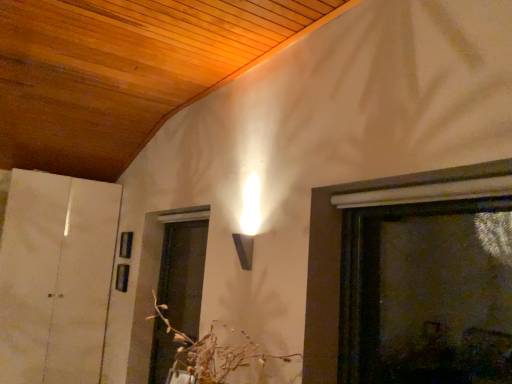
Question: Is white paper at left not inside brown textured floral arrangement at center?

Choices:
 (A) no
 (B) yes

Answer: (B)

Question: From the image's perspective, is white paper at left above brown textured floral arrangement at center?

Choices:
 (A) yes
 (B) no

Answer: (B)

Question: From the image's perspective, is white paper at left located beneath brown textured floral arrangement at center?

Choices:
 (A) no
 (B) yes

Answer: (B)

Question: Is the position of white paper at left less distant than that of brown textured floral arrangement at center?

Choices:
 (A) no
 (B) yes

Answer: (A)

Question: Is white paper at left to the right of brown textured floral arrangement at center from the viewer's perspective?

Choices:
 (A) no
 (B) yes

Answer: (A)

Question: Can you confirm if white paper at left is bigger than brown textured floral arrangement at center?

Choices:
 (A) no
 (B) yes

Answer: (B)

Question: From a real-world perspective, is white paper at left physically below translucent glass screen door at lower center?

Choices:
 (A) yes
 (B) no

Answer: (B)

Question: Can you confirm if white paper at left is thinner than translucent glass screen door at lower center?

Choices:
 (A) no
 (B) yes

Answer: (A)

Question: Does white paper at left have a greater width compared to translucent glass screen door at lower center?

Choices:
 (A) no
 (B) yes

Answer: (B)

Question: Is white paper at left shorter than translucent glass screen door at lower center?

Choices:
 (A) yes
 (B) no

Answer: (B)

Question: Is translucent glass screen door at lower center at the back of white paper at left?

Choices:
 (A) no
 (B) yes

Answer: (A)

Question: Is white paper at left at the left side of translucent glass screen door at lower center?

Choices:
 (A) yes
 (B) no

Answer: (A)

Question: Does translucent glass screen door at lower center appear on the right side of white paper at left?

Choices:
 (A) no
 (B) yes

Answer: (B)